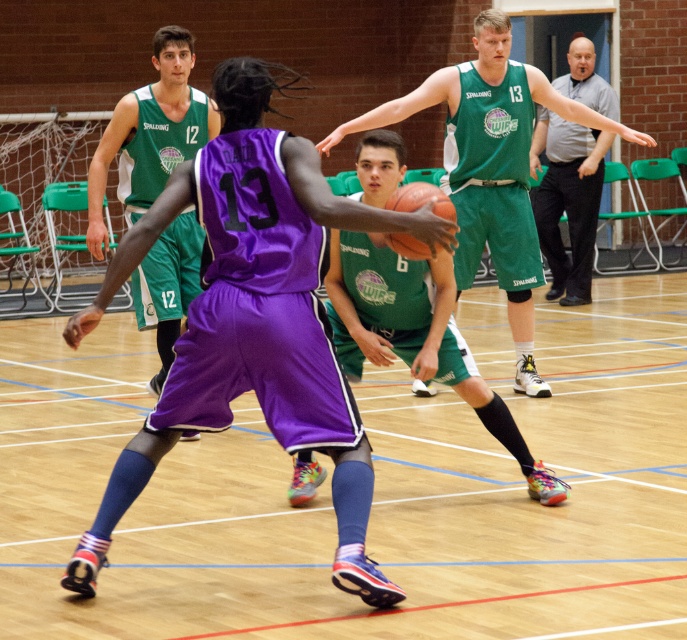
Is purple matte basketball player at center thinner than gray casual shirt at upper right?

Incorrect, purple matte basketball player at center's width is not less than gray casual shirt at upper right's.

This screenshot has width=687, height=640. Describe the element at coordinates (416, 333) in the screenshot. I see `purple matte basketball player at center` at that location.

The width and height of the screenshot is (687, 640). I want to click on purple matte basketball player at center, so [416, 333].

Does green jersey at center come behind gray casual shirt at upper right?

No, green jersey at center is in front of gray casual shirt at upper right.

Which is more to the left, green jersey at center or gray casual shirt at upper right?

green jersey at center is more to the left.

What do you see at coordinates (491, 156) in the screenshot? This screenshot has width=687, height=640. I see `green jersey at center` at bounding box center [491, 156].

Identify the location of green jersey at center. This screenshot has height=640, width=687. (491, 156).

Is purple matte basketball player at center bigger than orange matte basketball at center?

Yes, purple matte basketball player at center is bigger than orange matte basketball at center.

Does point (405, 337) come closer to viewer compared to point (423, 248)?

No, it is behind (423, 248).

Is point (401, 317) closer to camera compared to point (436, 186)?

No.

You are a GUI agent. You are given a task and a screenshot of the screen. Output one action in this format:
    pyautogui.click(x=<x>, y=<y>)
    Task: Click on the purple matte basketball player at center
    The width and height of the screenshot is (687, 640).
    Given the screenshot: What is the action you would take?
    pyautogui.click(x=416, y=333)